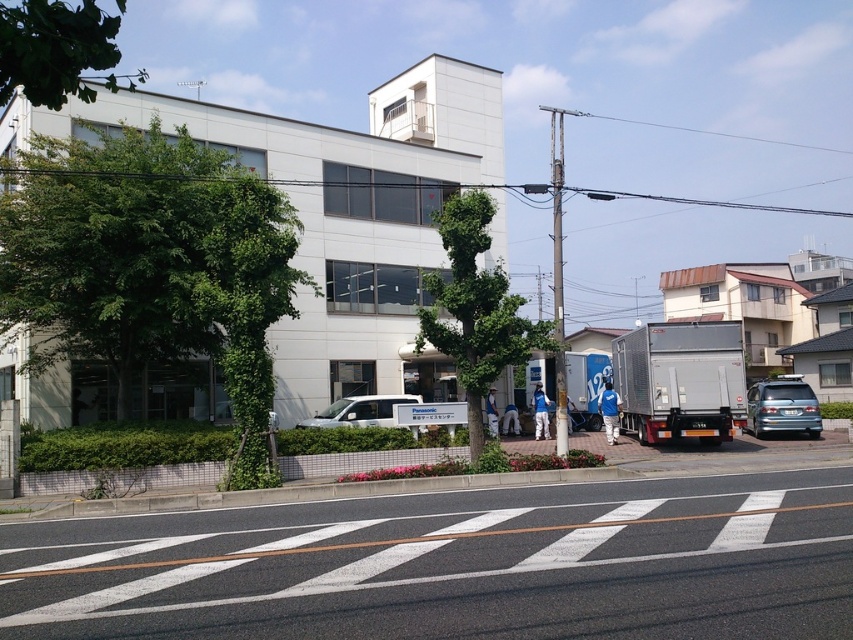
Which is below, green leafy tree at left or silver metallic truck at right?

Positioned lower is silver metallic truck at right.

Consider the image. Who is more distant from viewer, (10, 296) or (735, 410)?

The point (735, 410) is behind.

Where is `green leafy tree at left`? The width and height of the screenshot is (853, 640). green leafy tree at left is located at coordinates (149, 266).

Is green leafy tree at left positioned before white matte van at center?

That is True.

You are a GUI agent. You are given a task and a screenshot of the screen. Output one action in this format:
    pyautogui.click(x=<x>, y=<y>)
    Task: Click on the green leafy tree at left
    
    Given the screenshot: What is the action you would take?
    pyautogui.click(x=149, y=266)

You are a GUI agent. You are given a task and a screenshot of the screen. Output one action in this format:
    pyautogui.click(x=<x>, y=<y>)
    Task: Click on the green leafy tree at left
    The width and height of the screenshot is (853, 640).
    Given the screenshot: What is the action you would take?
    pyautogui.click(x=149, y=266)

Between point (456, 284) and point (117, 60), which one is positioned in front?

Point (117, 60)

Locate an element on the screen. green leafy tree at center is located at coordinates click(474, 308).